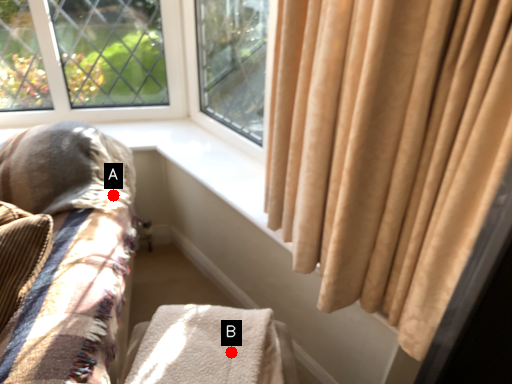
Question: Two points are circled on the image, labeled by A and B beside each circle. Which point is farther from the camera taking this photo?

Choices:
 (A) A is further
 (B) B is further

Answer: (A)